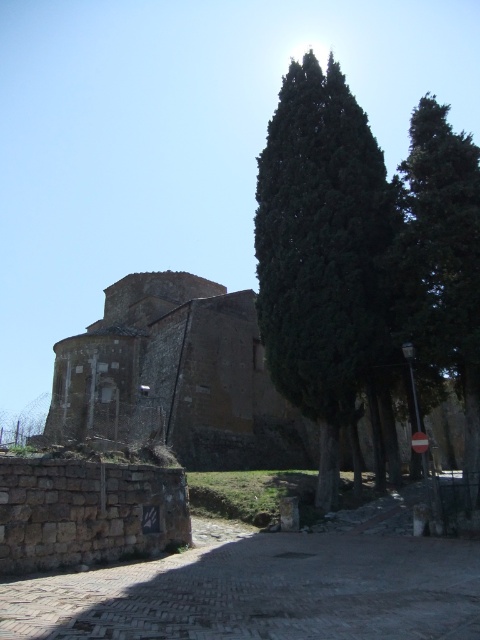
Question: Considering the relative positions of green leafy tree at center and green leafy tree at right in the image provided, where is green leafy tree at center located with respect to green leafy tree at right?

Choices:
 (A) above
 (B) below

Answer: (A)

Question: Can you confirm if green leafy tree at center is thinner than green leafy tree at right?

Choices:
 (A) yes
 (B) no

Answer: (B)

Question: Which of the following is the farthest from the observer?

Choices:
 (A) green leafy tree at right
 (B) green leafy tree at center

Answer: (B)

Question: Which of the following is the farthest from the observer?

Choices:
 (A) green leafy tree at center
 (B) green leafy tree at right

Answer: (A)

Question: Is green leafy tree at center above green leafy tree at right?

Choices:
 (A) no
 (B) yes

Answer: (B)